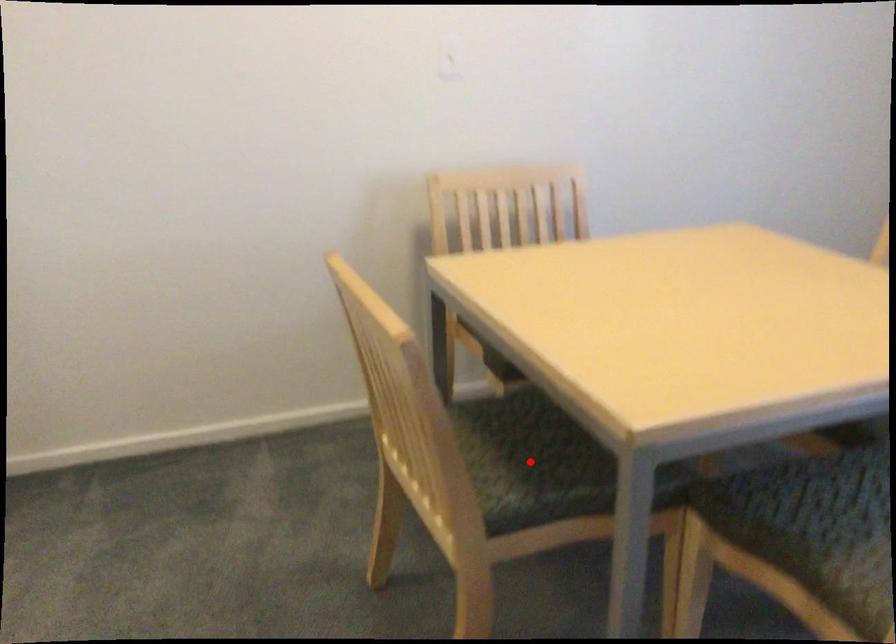
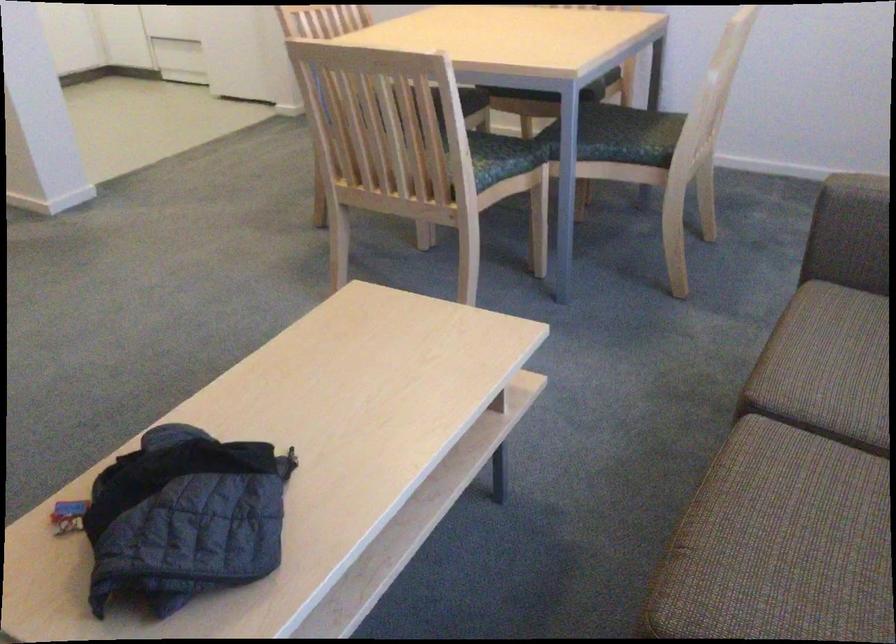
Question: I am providing you with two images of the same scene from different viewpoints. A red point is marked on the first image. At the location where the point appears in image 1, is it still visible in image 2?

Choices:
 (A) Yes
 (B) No

Answer: (B)